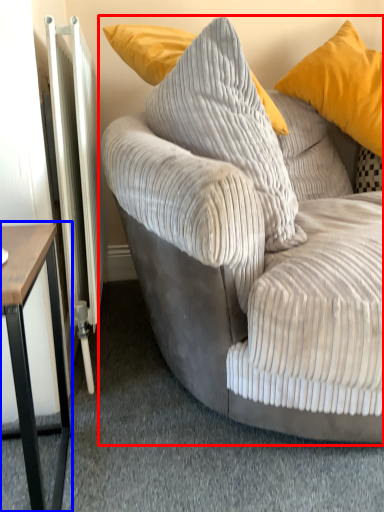
Question: Which of the following is the farthest to the observer, studio couch (highlighted by a red box) or table (highlighted by a blue box)?

Choices:
 (A) studio couch
 (B) table

Answer: (B)